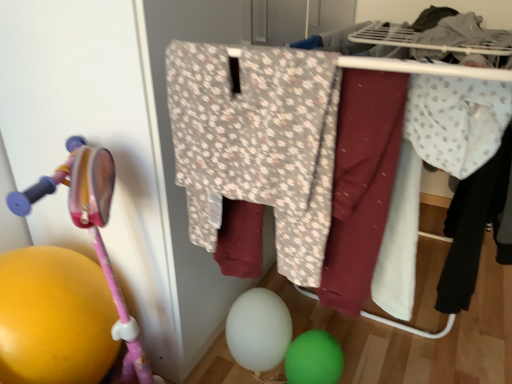
Question: Is green rubber balloon at lower center, which ranks as the second balloon in left-to-right order, aimed at floral fabric pants at center?

Choices:
 (A) no
 (B) yes

Answer: (A)

Question: Does green rubber balloon at lower center, arranged as the first balloon when viewed from the right, contain floral fabric pants at center?

Choices:
 (A) no
 (B) yes

Answer: (A)

Question: Is green rubber balloon at lower center, which ranks as the second balloon in left-to-right order, next to floral fabric pants at center?

Choices:
 (A) yes
 (B) no

Answer: (B)

Question: Is the position of green rubber balloon at lower center, which ranks as the second balloon in left-to-right order, more distant than that of floral fabric pants at center?

Choices:
 (A) no
 (B) yes

Answer: (B)

Question: Does green rubber balloon at lower center, arranged as the first balloon when viewed from the right, appear on the right side of floral fabric pants at center?

Choices:
 (A) no
 (B) yes

Answer: (B)

Question: From their relative heights in the image, would you say white dotted fabric at right, the 2th clothing viewed from the right, is taller or shorter than floral-patterned fabric at center, acting as the 1th clothing starting from the left?

Choices:
 (A) tall
 (B) short

Answer: (B)

Question: Is point (425, 115) closer or farther from the camera than point (271, 72)?

Choices:
 (A) closer
 (B) farther

Answer: (B)

Question: From the image's perspective, relative to floral-patterned fabric at center, which ranks as the 3th clothing in back-to-front order, is white dotted fabric at right, which is the 2th clothing from front to back, above or below?

Choices:
 (A) below
 (B) above

Answer: (B)

Question: From a real-world perspective, is white dotted fabric at right, the 2th clothing viewed from the right, above or below floral-patterned fabric at center, which is counted as the third clothing, starting from the right?

Choices:
 (A) above
 (B) below

Answer: (A)

Question: Considering the relative positions of pink plastic baby carriage at left and light blue dotted fabric at right, the 3th clothing positioned from the left, in the image provided, is pink plastic baby carriage at left to the left or to the right of light blue dotted fabric at right, the 3th clothing positioned from the left,?

Choices:
 (A) left
 (B) right

Answer: (A)

Question: From the image's perspective, is pink plastic baby carriage at left positioned above or below light blue dotted fabric at right, the 3th clothing viewed from the front?

Choices:
 (A) above
 (B) below

Answer: (B)

Question: Is pink plastic baby carriage at left wider or thinner than light blue dotted fabric at right, the 3th clothing viewed from the front?

Choices:
 (A) wide
 (B) thin

Answer: (A)

Question: In terms of size, does pink plastic baby carriage at left appear bigger or smaller than light blue dotted fabric at right, which is the first clothing from right to left?

Choices:
 (A) big
 (B) small

Answer: (B)

Question: Considering the relative positions of white matte balloon at lower center, which is counted as the 2th balloon, starting from the right, and floral fabric pants at center in the image provided, is white matte balloon at lower center, which is counted as the 2th balloon, starting from the right, to the left or to the right of floral fabric pants at center?

Choices:
 (A) right
 (B) left

Answer: (B)

Question: Does point (240, 357) appear closer or farther from the camera than point (329, 253)?

Choices:
 (A) closer
 (B) farther

Answer: (B)